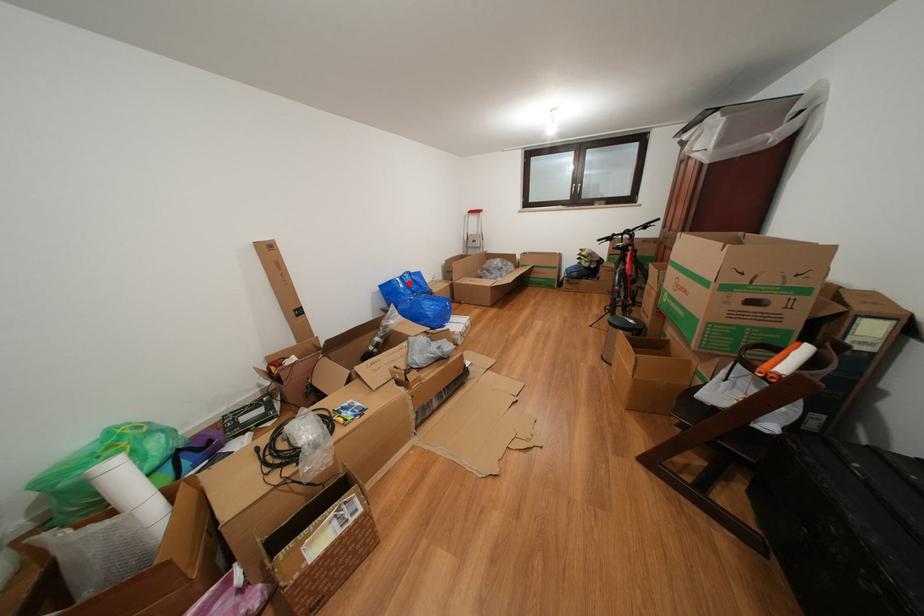
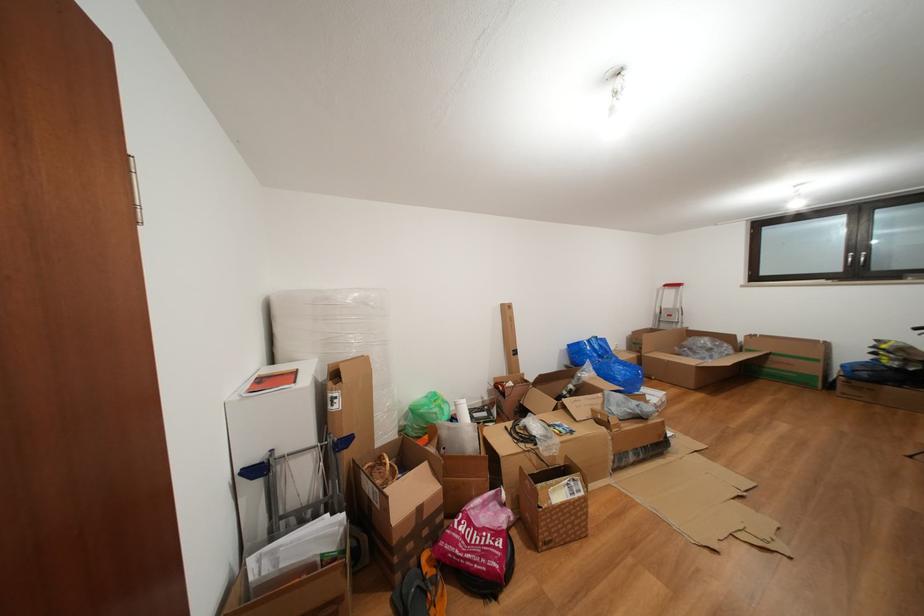
Question: A red point is marked in image1. In image2, is the corresponding 3D point closer to the camera or farther? Reply with the corresponding letter.

Choices:
 (A) The corresponding 3D point is closer.
 (B) The corresponding 3D point is farther.

Answer: (B)